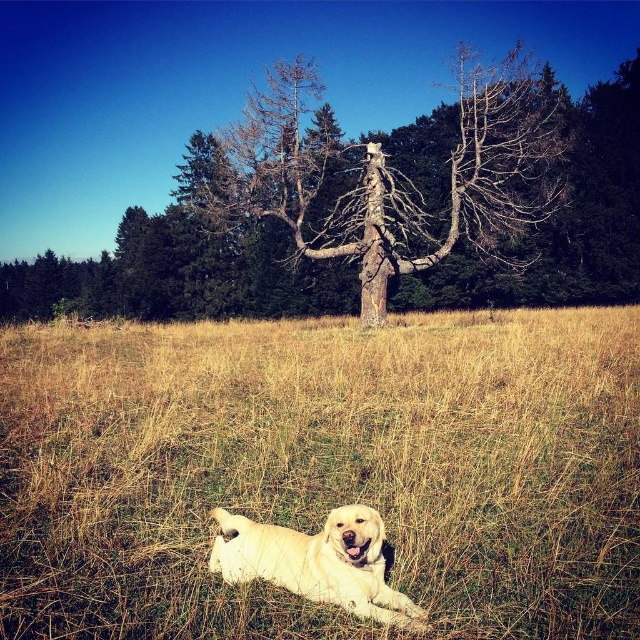
You are a photographer trying to capture the golden Labrador Retriever in the scene. The golden grass at center is located at coordinates 0.736, 0.505. If you want to position the dog in the exact center of your photo, should you move the dog or adjust your camera angle?

Since the golden grass at center is already at the center coordinates, you should adjust your camera angle to position the dog in the exact center without moving the dog.

You are a photographer trying to capture both points in the scene. Which point, point (120, 547) or point (561, 132), will appear larger in your photo?

Point (120, 547) will appear larger in the photo because it is closer to the camera than point (561, 132).

You are standing in the grassy field where the golden Labrador Retriever is resting. You notice two points marked in the scene. Which point is closer to you, point (x=284, y=193) or point (x=268, y=538)?

Point (x=284, y=193) is closer to you because it is further to the viewer than point (x=268, y=538).